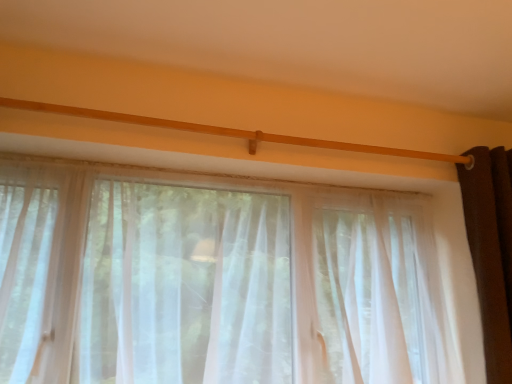
Question: Considering the relative sizes of dark brown velvet curtain at right, the first curtain when ordered from right to left, and sheer white curtain at upper center, marked as the 2th curtain in a right-to-left arrangement, in the image provided, is dark brown velvet curtain at right, the first curtain when ordered from right to left, taller than sheer white curtain at upper center, marked as the 2th curtain in a right-to-left arrangement,?

Choices:
 (A) no
 (B) yes

Answer: (B)

Question: Is dark brown velvet curtain at right, which is the second curtain from left to right, positioned beyond the bounds of sheer white curtain at upper center, which is the first curtain in left-to-right order?

Choices:
 (A) yes
 (B) no

Answer: (A)

Question: Could you tell me if dark brown velvet curtain at right, which is the second curtain from left to right, is turned towards sheer white curtain at upper center, marked as the 2th curtain in a right-to-left arrangement?

Choices:
 (A) yes
 (B) no

Answer: (B)

Question: Is dark brown velvet curtain at right, the first curtain when ordered from right to left, shorter than sheer white curtain at upper center, marked as the 2th curtain in a right-to-left arrangement?

Choices:
 (A) yes
 (B) no

Answer: (B)

Question: Considering the relative sizes of dark brown velvet curtain at right, which is the second curtain from left to right, and sheer white curtain at upper center, marked as the 2th curtain in a right-to-left arrangement, in the image provided, is dark brown velvet curtain at right, which is the second curtain from left to right, thinner than sheer white curtain at upper center, marked as the 2th curtain in a right-to-left arrangement,?

Choices:
 (A) no
 (B) yes

Answer: (B)

Question: From the image's perspective, is dark brown velvet curtain at right, the first curtain when ordered from right to left, on sheer white curtain at upper center, which is the first curtain in left-to-right order?

Choices:
 (A) yes
 (B) no

Answer: (A)

Question: Considering the relative sizes of sheer white curtain at upper center, which is the first curtain in left-to-right order, and dark brown velvet curtain at right, which is the second curtain from left to right, in the image provided, is sheer white curtain at upper center, which is the first curtain in left-to-right order, shorter than dark brown velvet curtain at right, which is the second curtain from left to right,?

Choices:
 (A) no
 (B) yes

Answer: (B)

Question: From a real-world perspective, is sheer white curtain at upper center, marked as the 2th curtain in a right-to-left arrangement, below dark brown velvet curtain at right, the first curtain when ordered from right to left?

Choices:
 (A) yes
 (B) no

Answer: (A)

Question: Is sheer white curtain at upper center, which is the first curtain in left-to-right order, positioned in front of dark brown velvet curtain at right, the first curtain when ordered from right to left?

Choices:
 (A) yes
 (B) no

Answer: (A)

Question: Is sheer white curtain at upper center, marked as the 2th curtain in a right-to-left arrangement, oriented away from dark brown velvet curtain at right, which is the second curtain from left to right?

Choices:
 (A) yes
 (B) no

Answer: (B)

Question: Considering the relative positions of sheer white curtain at upper center, which is the first curtain in left-to-right order, and dark brown velvet curtain at right, which is the second curtain from left to right, in the image provided, is sheer white curtain at upper center, which is the first curtain in left-to-right order, to the right of dark brown velvet curtain at right, which is the second curtain from left to right, from the viewer's perspective?

Choices:
 (A) no
 (B) yes

Answer: (A)

Question: Is sheer white curtain at upper center, which is the first curtain in left-to-right order, outside of dark brown velvet curtain at right, which is the second curtain from left to right?

Choices:
 (A) yes
 (B) no

Answer: (A)

Question: Relative to dark brown velvet curtain at right, the first curtain when ordered from right to left, is sheer white curtain at upper center, marked as the 2th curtain in a right-to-left arrangement, in front or behind?

Choices:
 (A) behind
 (B) front

Answer: (B)